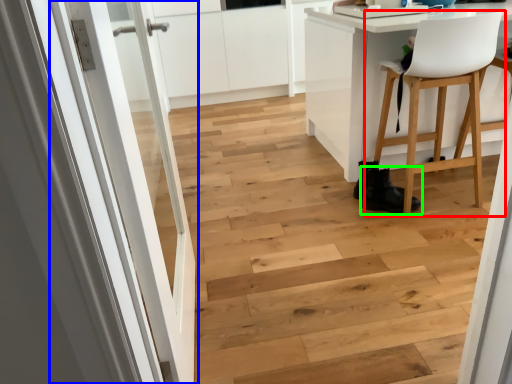
Question: Which object is the farthest from chair (highlighted by a red box)? Choose among these: door (highlighted by a blue box) or footwear (highlighted by a green box).

Choices:
 (A) door
 (B) footwear

Answer: (A)